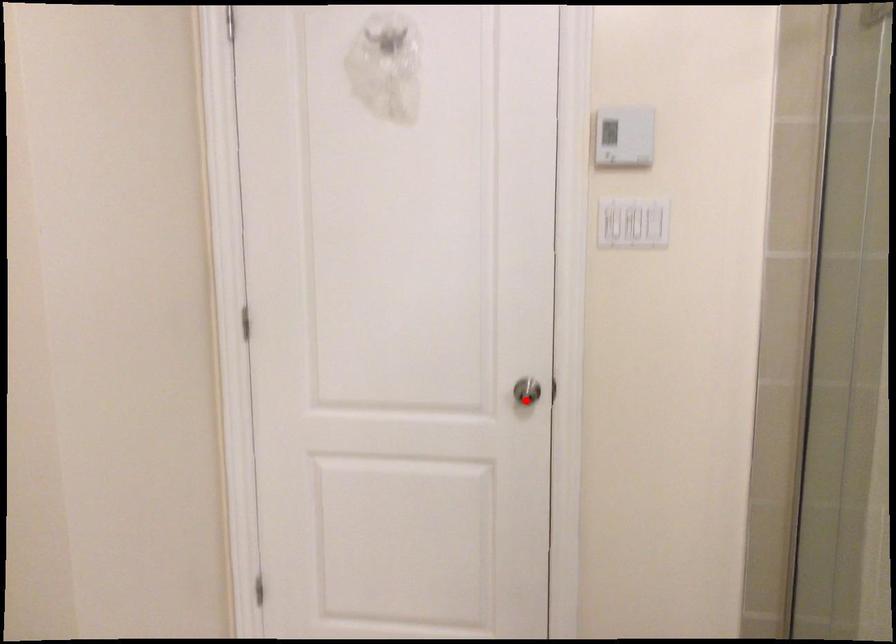
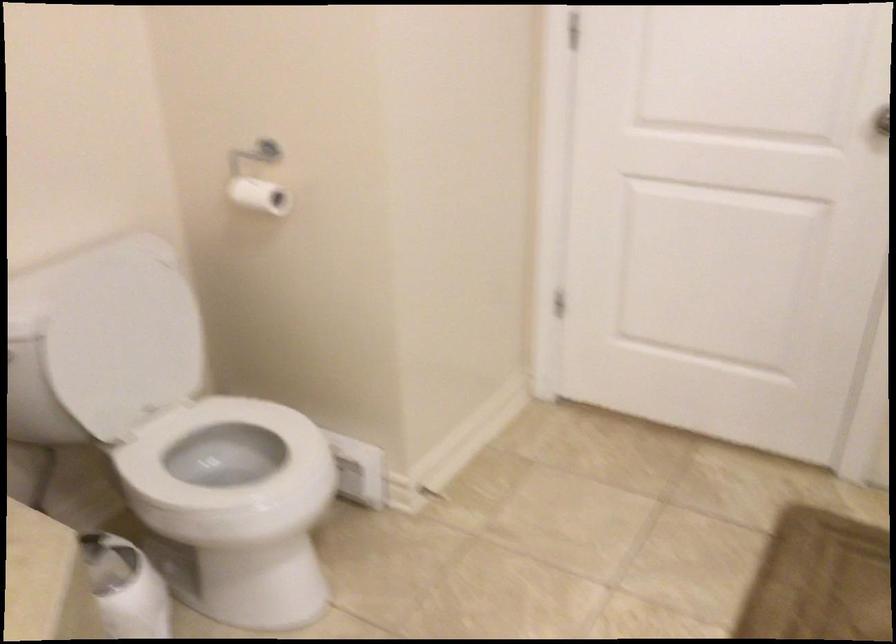
Question: I am providing you with two images of the same scene from different viewpoints. In image1, a red point is highlighted. Considering the same 3D point in image2, which of the following is correct?

Choices:
 (A) It is closer
 (B) It is farther

Answer: (A)